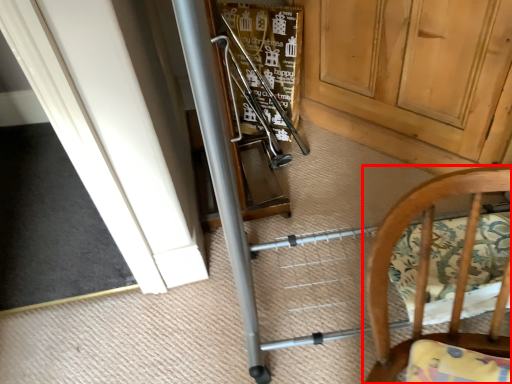
Question: From the image's perspective, where is chair (annotated by the red box) located in relation to door in the image?

Choices:
 (A) below
 (B) above

Answer: (A)